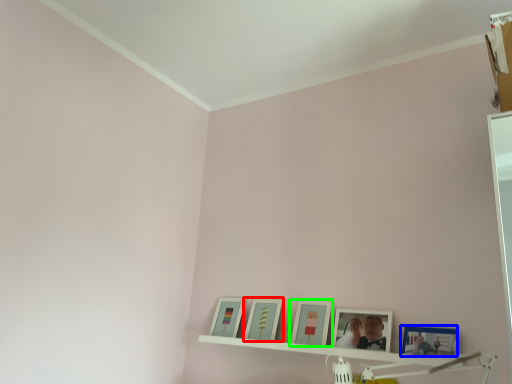
Question: Which object is the closest to the picture frame (highlighted by a red box)? Choose among these: picture frame (highlighted by a blue box) or picture frame (highlighted by a green box).

Choices:
 (A) picture frame
 (B) picture frame

Answer: (B)